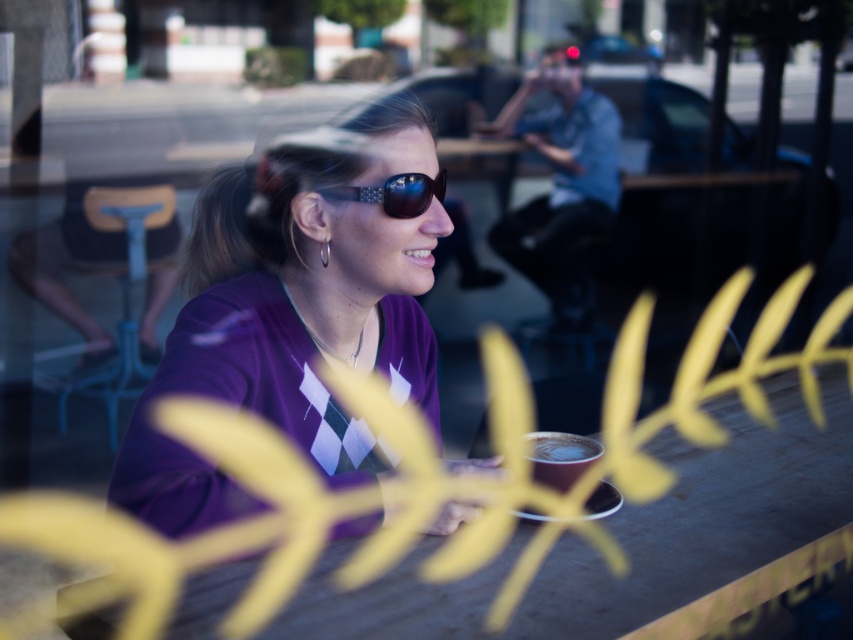
Is smooth wooden table at center thinner than shiny black sunglasses at center?

In fact, smooth wooden table at center might be wider than shiny black sunglasses at center.

Consider the image. Can you confirm if smooth wooden table at center is positioned above shiny black sunglasses at center?

Actually, smooth wooden table at center is below shiny black sunglasses at center.

Where is `smooth wooden table at center`? This screenshot has width=853, height=640. smooth wooden table at center is located at coordinates (711, 525).

Where is `smooth wooden table at center`? smooth wooden table at center is located at coordinates (711, 525).

Which is more to the left, cappuccino foam at center or matte black coffee cup at center?

matte black coffee cup at center

Looking at this image, is cappuccino foam at center thinner than matte black coffee cup at center?

Incorrect, cappuccino foam at center's width is not less than matte black coffee cup at center's.

Between point (558, 449) and point (567, 442), which one is positioned in front?

Point (558, 449) is in front.

Locate an element on the screen. The height and width of the screenshot is (640, 853). cappuccino foam at center is located at coordinates (561, 458).

Is smooth wooden table at center bigger than matte black coffee cup at center?

Yes, smooth wooden table at center is bigger than matte black coffee cup at center.

Is point (618, 634) in front of point (564, 445)?

Yes, it is.

This screenshot has width=853, height=640. I want to click on smooth wooden table at center, so click(x=711, y=525).